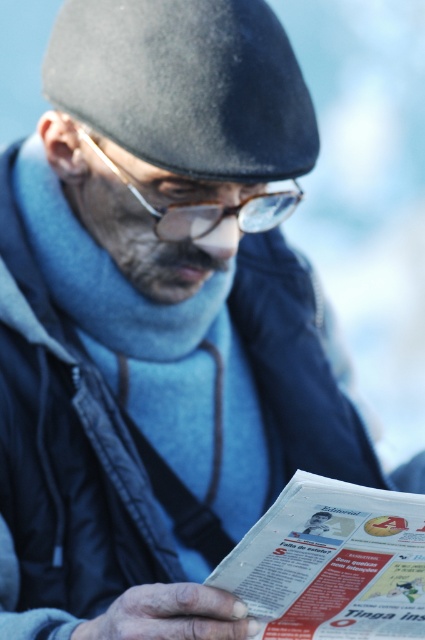
Which of these two, printed paper at lower center or clear plastic glasses at center, stands taller?

With more height is printed paper at lower center.

Who is lower down, printed paper at lower center or clear plastic glasses at center?

printed paper at lower center is below.

Is point (334, 486) closer to viewer compared to point (163, 208)?

Yes, it is.

The height and width of the screenshot is (640, 425). I want to click on printed paper at lower center, so click(331, 563).

Between point (303, 125) and point (243, 556), which one is positioned in front?

Positioned in front is point (243, 556).

Is dark gray felt beret at upper center above printed paper at lower center?

Yes.

This screenshot has width=425, height=640. I want to click on dark gray felt beret at upper center, so click(x=186, y=84).

I want to click on dark gray felt beret at upper center, so click(186, 84).

Can you confirm if dark gray felt beret at upper center is bigger than clear plastic glasses at center?

Yes, dark gray felt beret at upper center is bigger than clear plastic glasses at center.

Which is above, dark gray felt beret at upper center or clear plastic glasses at center?

dark gray felt beret at upper center

Who is more forward, (183, 116) or (193, 237)?

Point (183, 116)

Find the location of a particular element. The image size is (425, 640). dark gray felt beret at upper center is located at coordinates (186, 84).